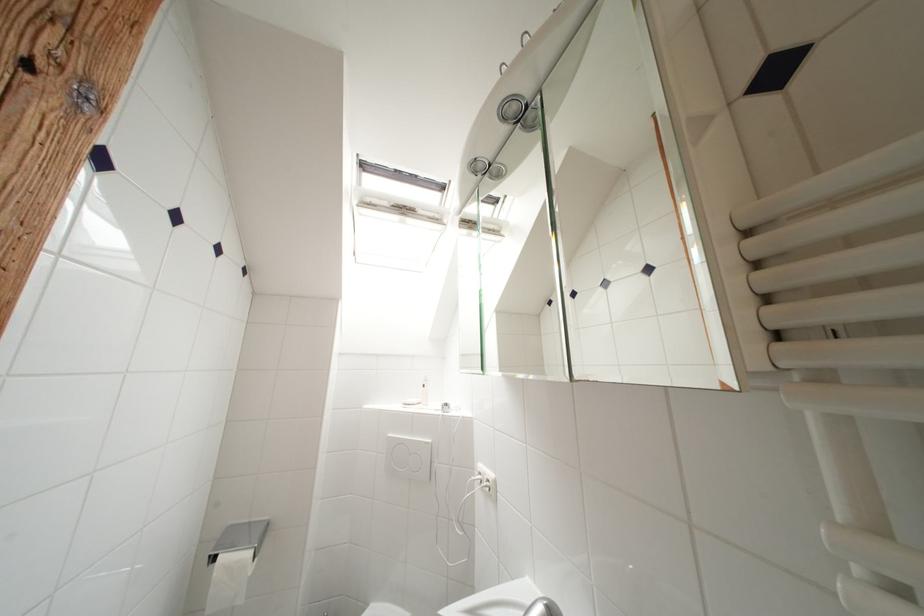
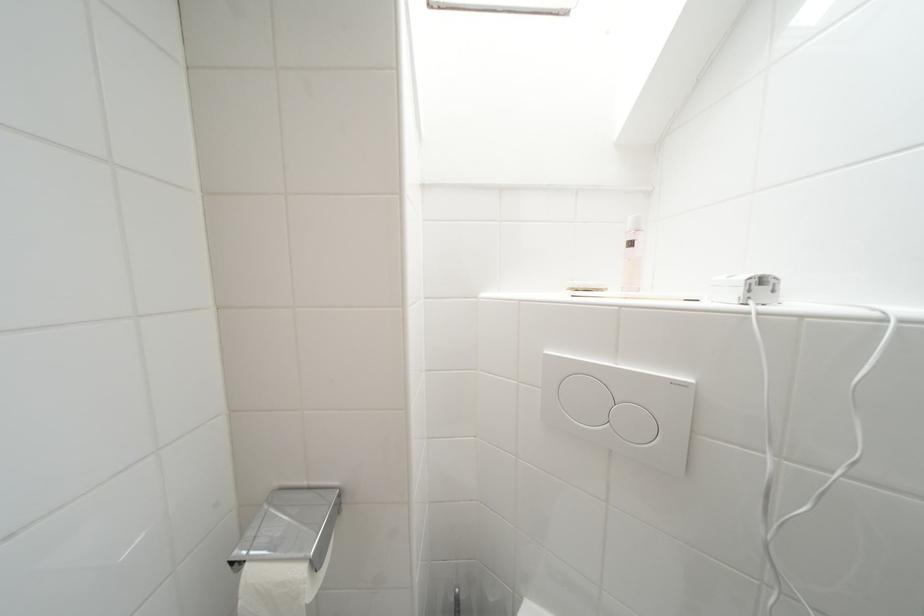
Based on the continuous images, in which direction is the camera rotating?

The camera's rotation is toward left-down.